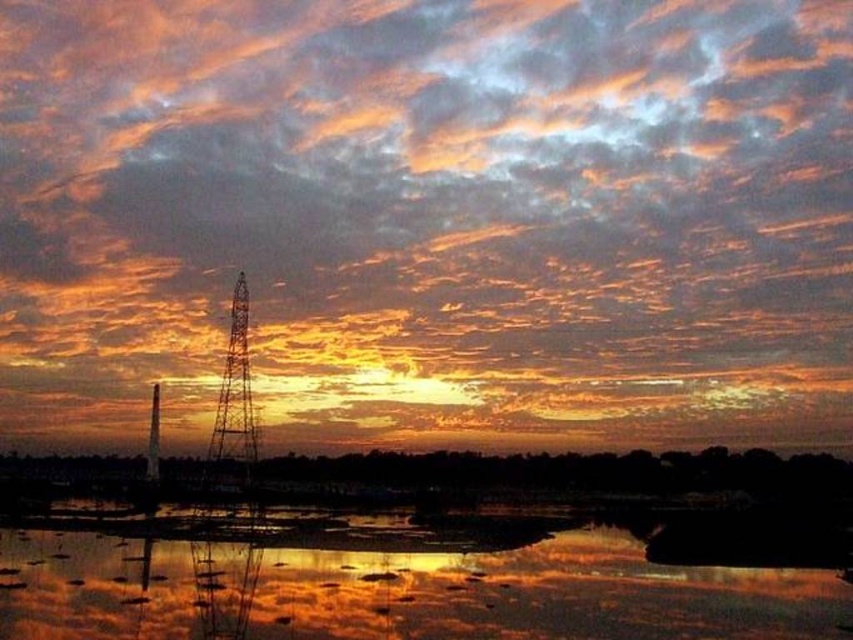
Question: Considering the relative positions of orange matte cloud at upper center and reflective water at center in the image provided, where is orange matte cloud at upper center located with respect to reflective water at center?

Choices:
 (A) right
 (B) left

Answer: (A)

Question: Is orange matte cloud at upper center smaller than reflective water at center?

Choices:
 (A) yes
 (B) no

Answer: (B)

Question: Which object is the closest to the reflective water at center?

Choices:
 (A) metallic wire tower at center
 (B) orange matte cloud at upper center

Answer: (B)

Question: Does reflective water at center have a larger size compared to metallic wire tower at center?

Choices:
 (A) no
 (B) yes

Answer: (B)

Question: Which object is positioned closest to the reflective water at center?

Choices:
 (A) metallic wire tower at center
 (B) orange matte cloud at upper center

Answer: (B)

Question: Among these points, which one is nearest to the camera?

Choices:
 (A) (231, 316)
 (B) (312, 132)

Answer: (B)